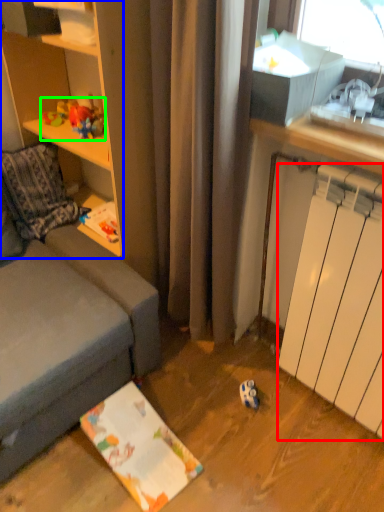
Question: Which is nearer to the radiator (highlighted by a red box)? cabinetry (highlighted by a blue box) or toy (highlighted by a green box).

Choices:
 (A) cabinetry
 (B) toy

Answer: (A)